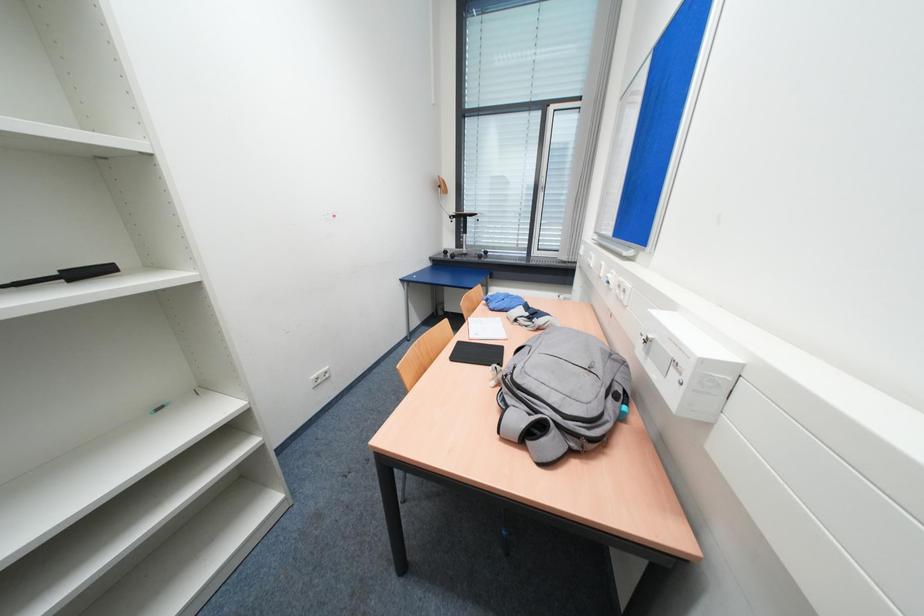
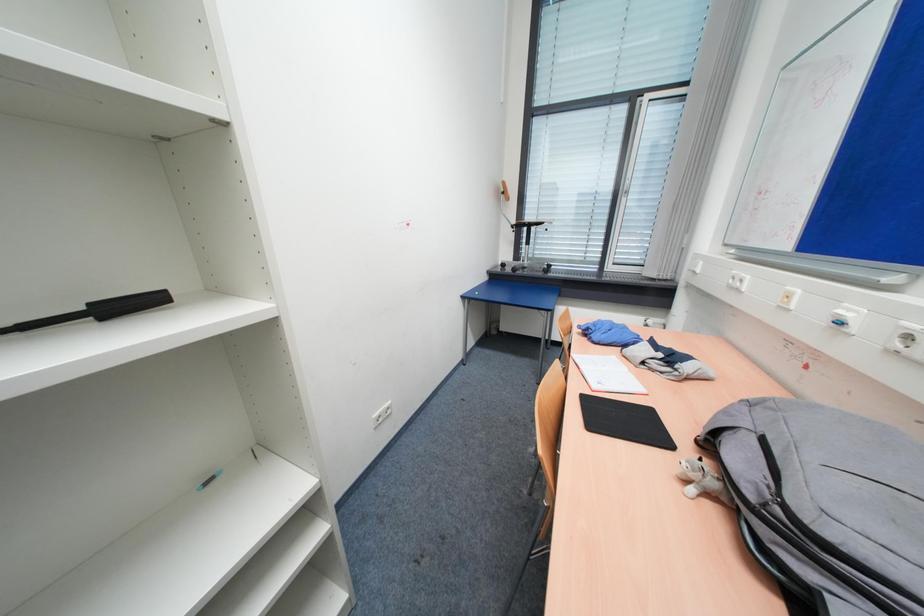
The images are taken continuously from a first-person perspective. In which direction are you moving?

The cameraman walked toward left, forward.